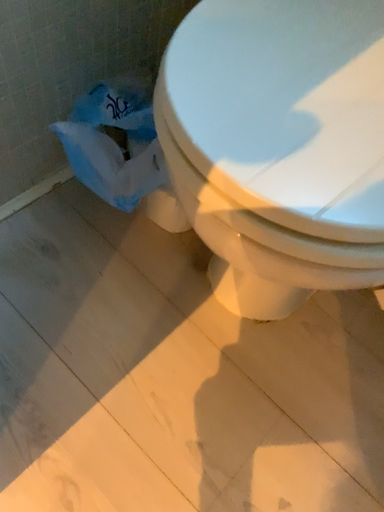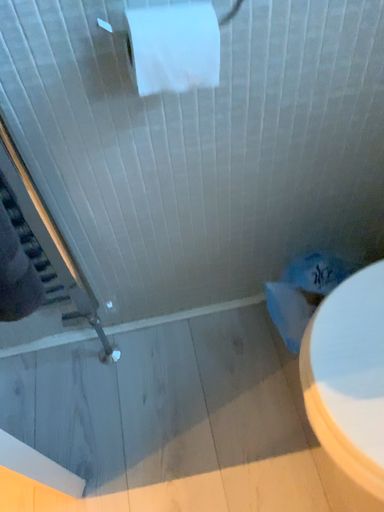
Question: Which way did the camera rotate in the video?

Choices:
 (A) rotated right
 (B) rotated left

Answer: (B)